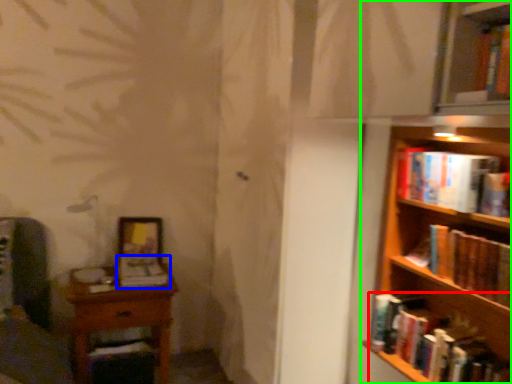
Question: Which object is the farthest from book (highlighted by a red box)? Choose among these: book (highlighted by a blue box) or bookcase (highlighted by a green box).

Choices:
 (A) book
 (B) bookcase

Answer: (A)